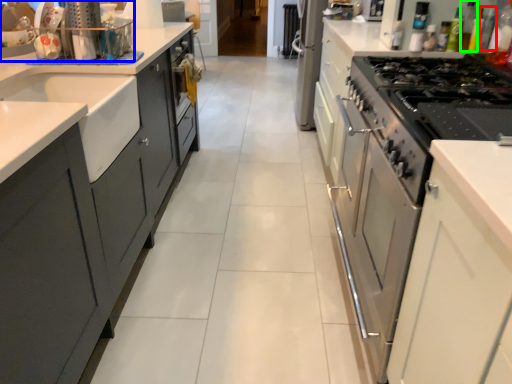
Question: Based on their relative distances, which object is nearer to bottle (highlighted by a red box)? Choose from kitchen appliance (highlighted by a blue box) and bottle (highlighted by a green box).

Choices:
 (A) kitchen appliance
 (B) bottle

Answer: (B)